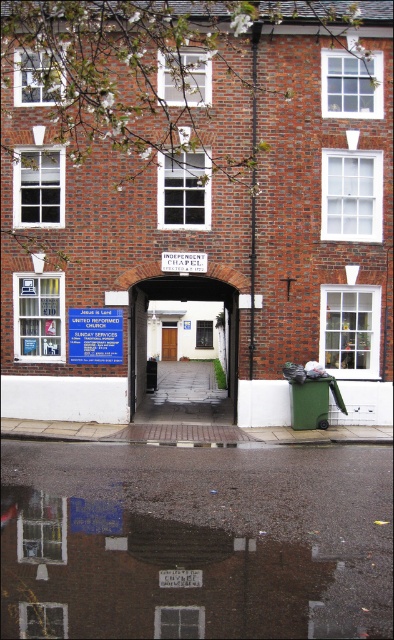
You are a visitor arriving at the Independent Chapel and need to enter the building. You see the white wooden door at center and the blue plastic sign at center. Which object should you interact with to gain entry?

To gain entry, you should interact with the white wooden door at center, as it is the entrance. The blue plastic sign at center provides information but does not grant access.